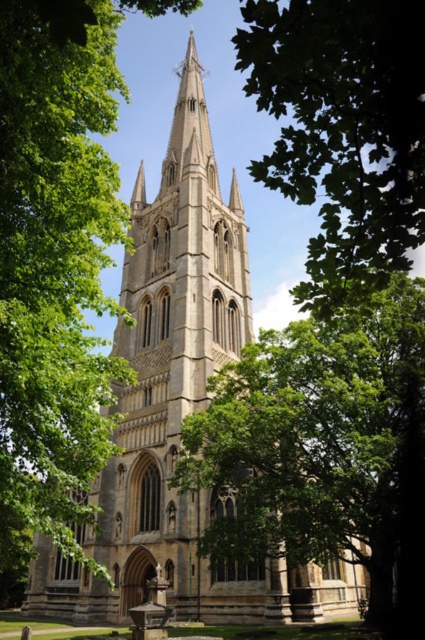
Question: Which point appears closest to the camera in this image?

Choices:
 (A) (289, 54)
 (B) (377, 364)

Answer: (A)

Question: Is green leafy tree at center positioned at the back of green leafy tree at upper center?

Choices:
 (A) no
 (B) yes

Answer: (B)

Question: Which of the following is the closest to the observer?

Choices:
 (A) green leafy tree at center
 (B) green leafy tree at upper center

Answer: (B)

Question: Among these points, which one is farthest from the camera?

Choices:
 (A) (379, 508)
 (B) (241, 45)

Answer: (A)

Question: Does green leafy tree at center have a greater width compared to green leafy tree at upper center?

Choices:
 (A) yes
 (B) no

Answer: (A)

Question: Is green leafy tree at center to the left of green leafy tree at upper center from the viewer's perspective?

Choices:
 (A) yes
 (B) no

Answer: (A)